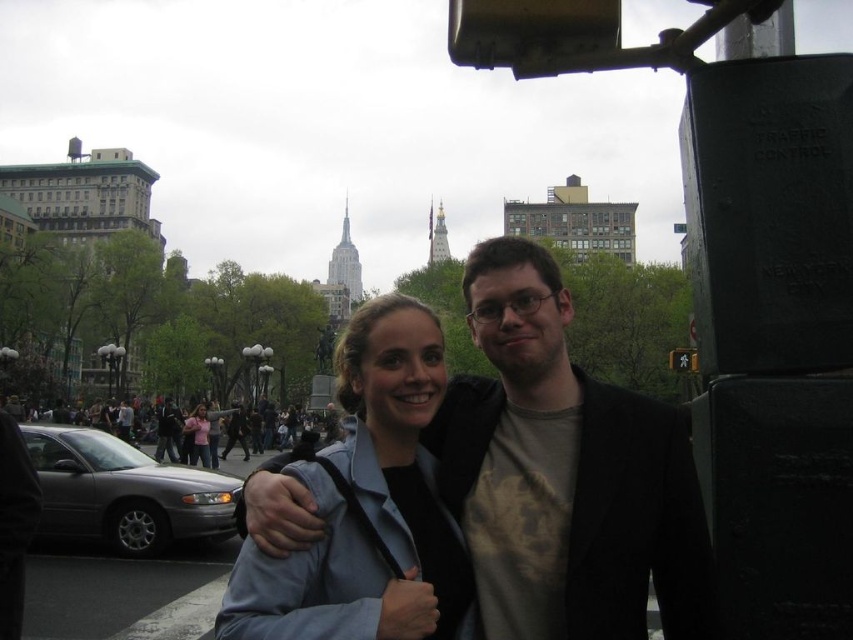
Question: Does matte black jacket at center have a greater width compared to light blue denim jacket at center?

Choices:
 (A) yes
 (B) no

Answer: (A)

Question: Which of these objects is positioned farthest from the metallic black traffic light at right?

Choices:
 (A) matte black jacket at center
 (B) pink fabric shirt at center

Answer: (B)

Question: Which point is farther to the camera?

Choices:
 (A) matte black jacket at center
 (B) light blue denim jacket at center
 (C) metallic black traffic light at right

Answer: (C)

Question: Which of the following is the closest to the observer?

Choices:
 (A) pink fabric shirt at center
 (B) light blue denim jacket at center
 (C) metallic black traffic light at right

Answer: (B)

Question: Does dark gray jacket at center appear on the right side of metallic black traffic light at right?

Choices:
 (A) yes
 (B) no

Answer: (B)

Question: Does light blue denim jacket at center have a greater width compared to dark gray jacket at center?

Choices:
 (A) yes
 (B) no

Answer: (A)